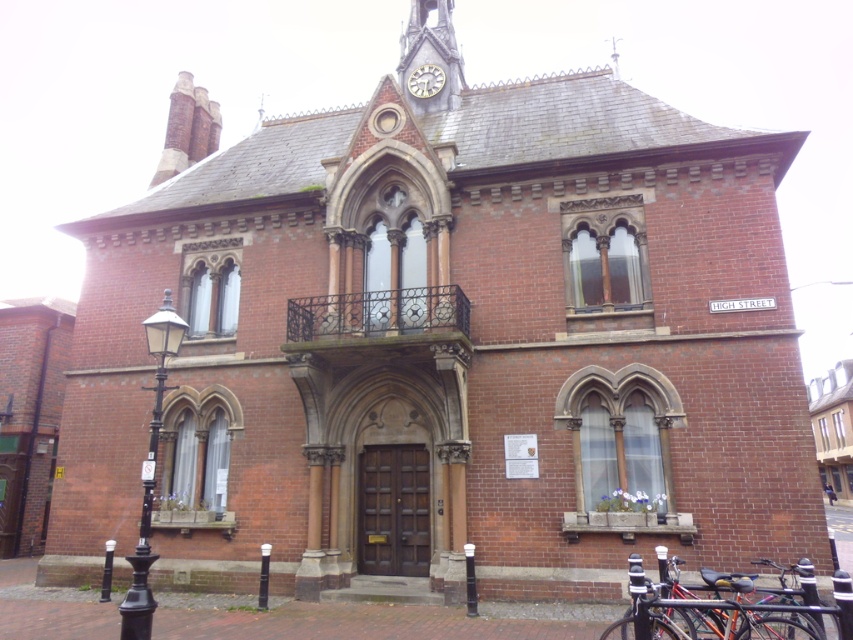
Which of these two, shiny black bicycle at lower right or gold metallic clock at upper center, stands taller?

shiny black bicycle at lower right

Based on the photo, who is more forward, (671, 624) or (424, 67)?

Point (671, 624) is in front.

In the scene shown: Measure the distance between shiny black bicycle at lower right and camera.

shiny black bicycle at lower right is 73.74 feet from camera.

This screenshot has width=853, height=640. In order to click on shiny black bicycle at lower right in this screenshot , I will do `click(706, 611)`.